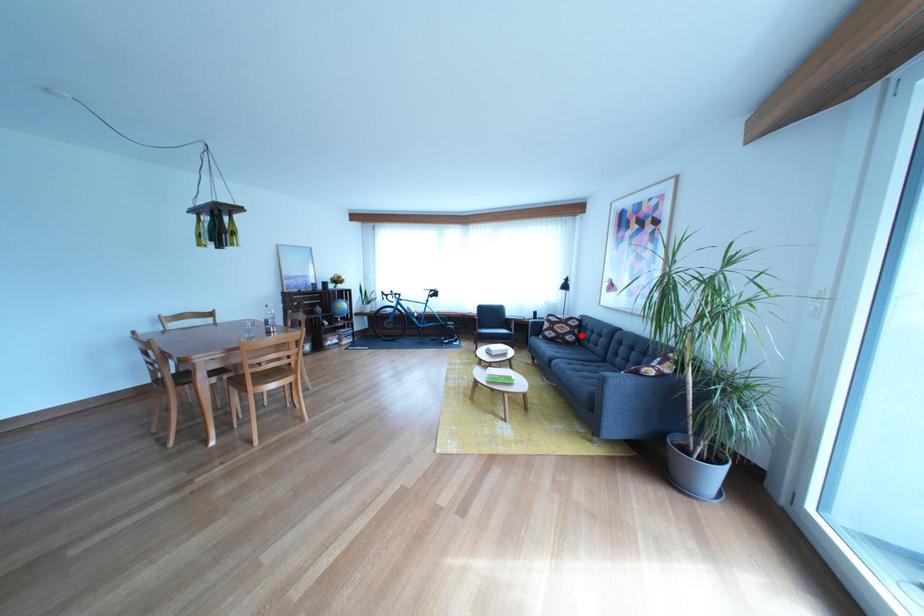
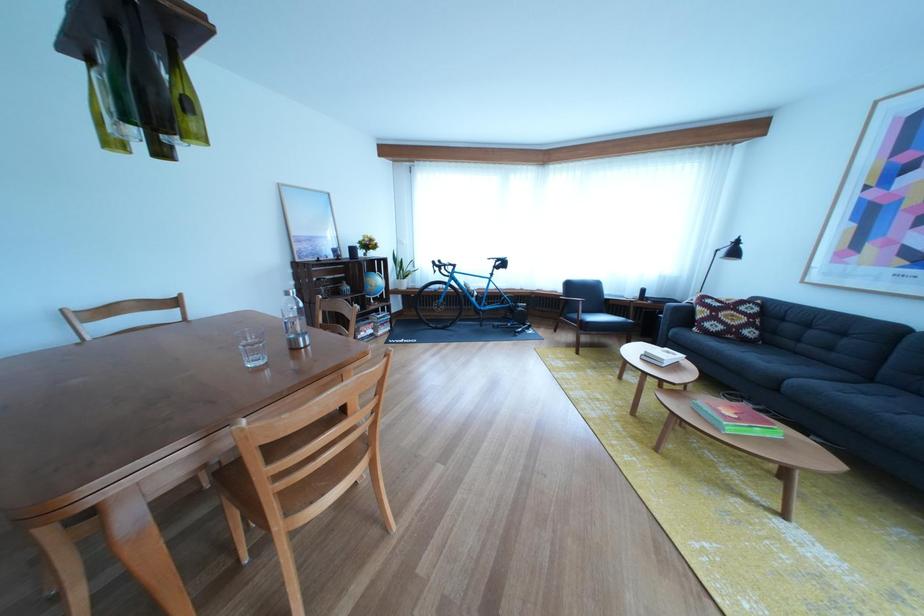
Where in the second image is the point corresponding to the highlighted location from the first image?

(757, 325)